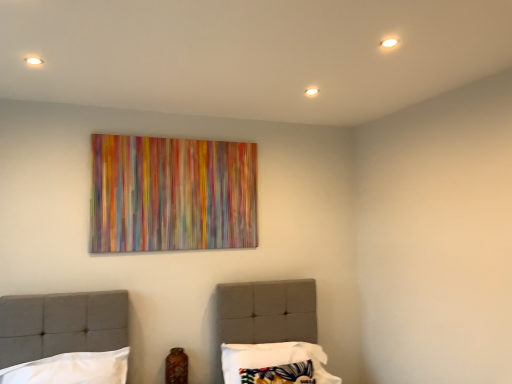
Question: Does point (314, 344) appear closer or farther from the camera than point (117, 357)?

Choices:
 (A) farther
 (B) closer

Answer: (A)

Question: Considering the positions of patterned fabric pillow at center, the second pillow when ordered from left to right, and white fabric pillow at lower left, which is the 2th pillow from right to left, in the image, is patterned fabric pillow at center, the second pillow when ordered from left to right, bigger or smaller than white fabric pillow at lower left, which is the 2th pillow from right to left,?

Choices:
 (A) small
 (B) big

Answer: (B)

Question: In the image, is patterned fabric pillow at center, the second pillow when ordered from left to right, positioned in front of or behind white fabric pillow at lower left, which ranks as the 1th pillow in left-to-right order?

Choices:
 (A) front
 (B) behind

Answer: (B)

Question: From a real-world perspective, is white fabric pillow at lower left, which is the 2th pillow from right to left, physically located above or below patterned fabric pillow at center, the second pillow when ordered from left to right?

Choices:
 (A) below
 (B) above

Answer: (B)

Question: Is white fabric pillow at lower left, which is the 2th pillow from right to left, taller or shorter than patterned fabric pillow at center, the 1th pillow when ordered from right to left?

Choices:
 (A) short
 (B) tall

Answer: (A)

Question: From the image's perspective, is white fabric pillow at lower left, which is the 2th pillow from right to left, positioned above or below patterned fabric pillow at center, the 1th pillow when ordered from right to left?

Choices:
 (A) above
 (B) below

Answer: (A)

Question: Considering the positions of white fabric pillow at lower left, which is the 2th pillow from right to left, and patterned fabric pillow at center, the 1th pillow when ordered from right to left, in the image, is white fabric pillow at lower left, which is the 2th pillow from right to left, wider or thinner than patterned fabric pillow at center, the 1th pillow when ordered from right to left,?

Choices:
 (A) wide
 (B) thin

Answer: (B)